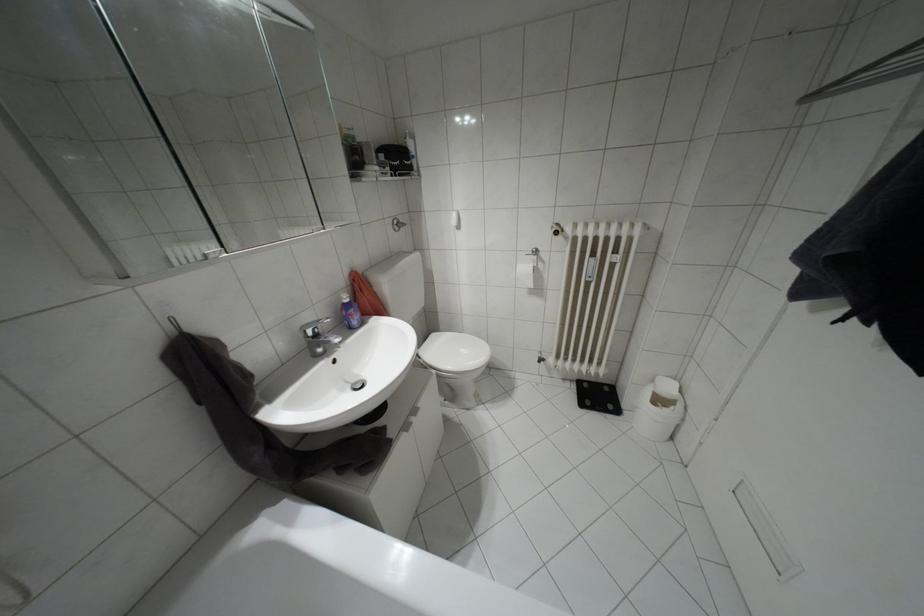
Image resolution: width=924 pixels, height=616 pixels. What do you see at coordinates (659, 408) in the screenshot? I see `a white trash can` at bounding box center [659, 408].